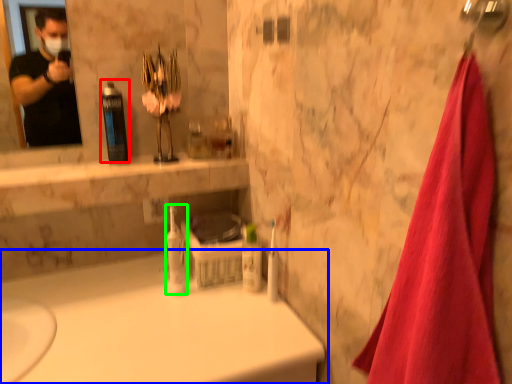
Question: Which object is the farthest from mouthwash (highlighted by a red box)? Choose among these: bathtub (highlighted by a blue box) or mouthwash (highlighted by a green box).

Choices:
 (A) bathtub
 (B) mouthwash

Answer: (A)